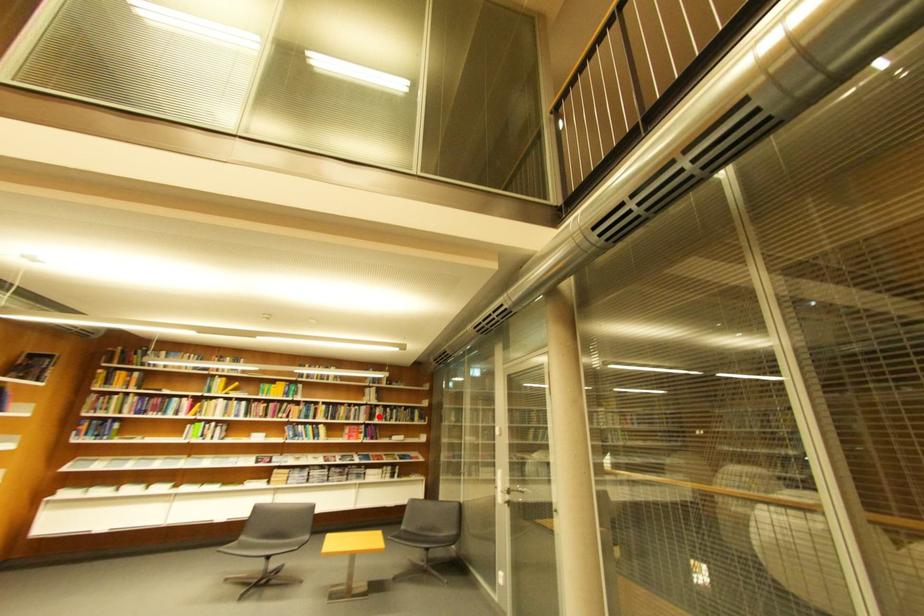
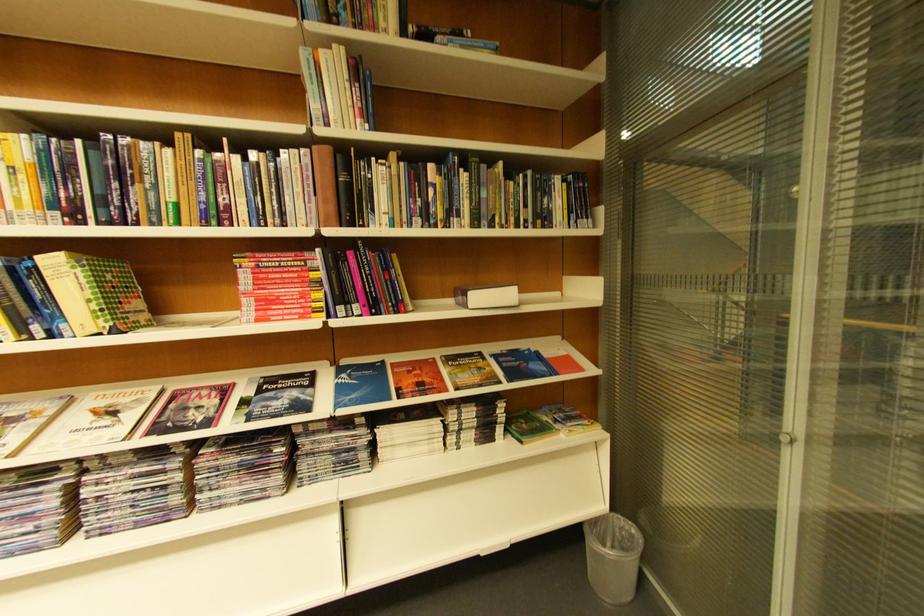
Where in the second image is the point corresponding to the highlighted location from the first image?

(342, 196)